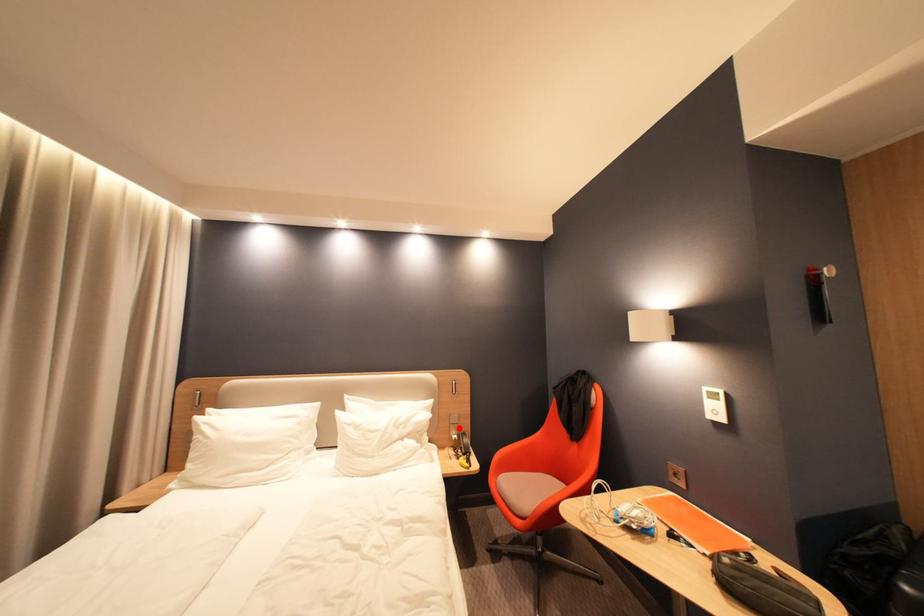
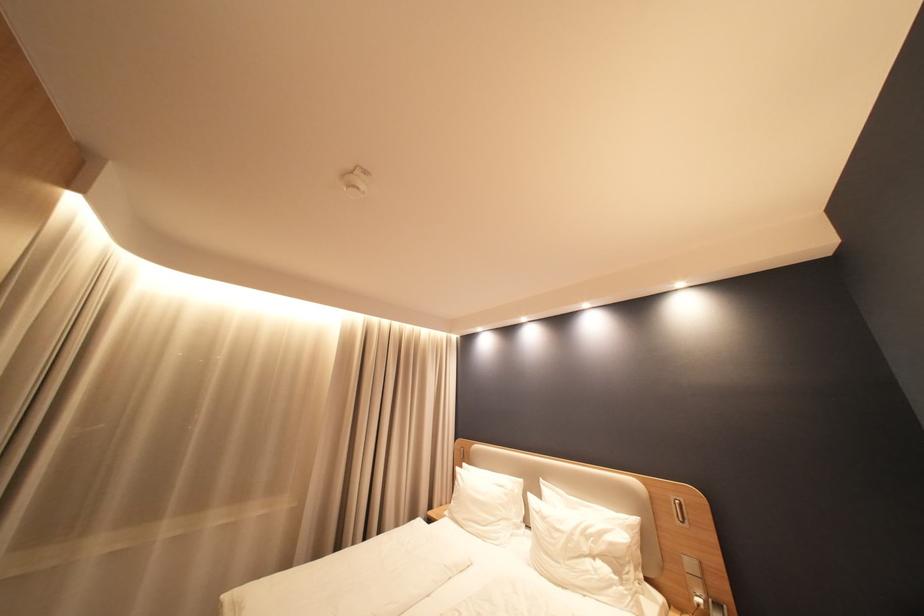
Question: A red point is marked in image1. In image2, is the corresponding 3D point closer to the camera or farther? Reply with the corresponding letter.

Choices:
 (A) The corresponding 3D point is closer.
 (B) The corresponding 3D point is farther.

Answer: (A)